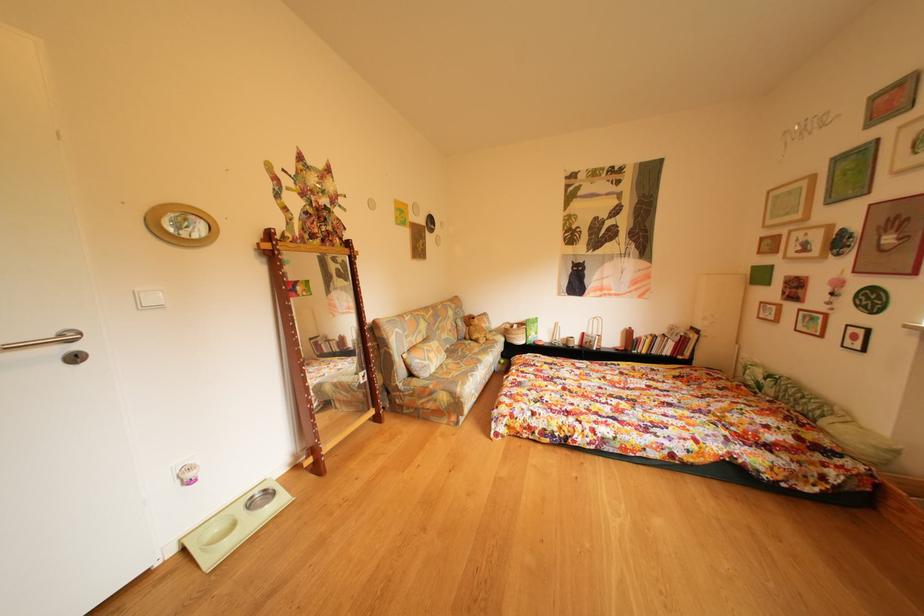
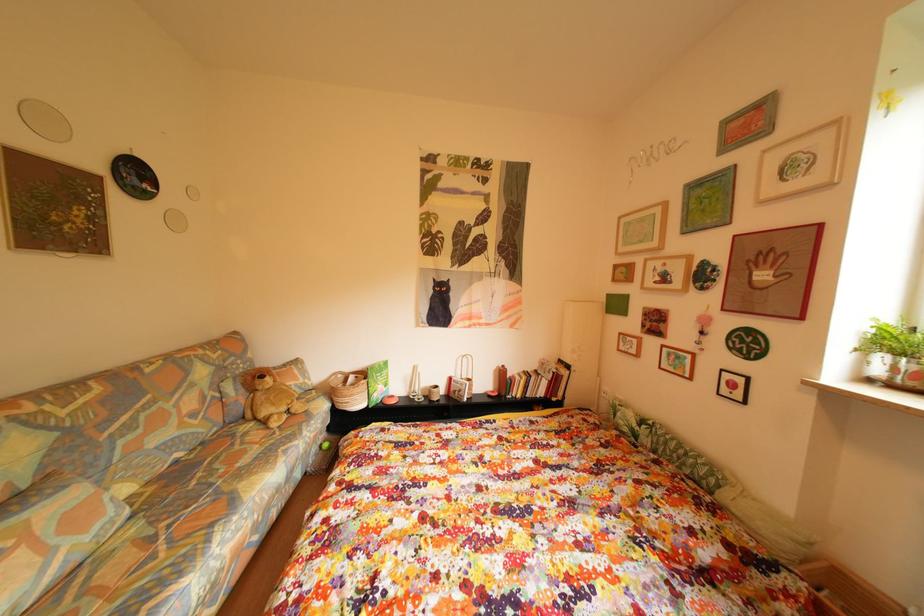
What movement of the cameraman would produce the second image?

The movement direction of the cameraman is right, forward.